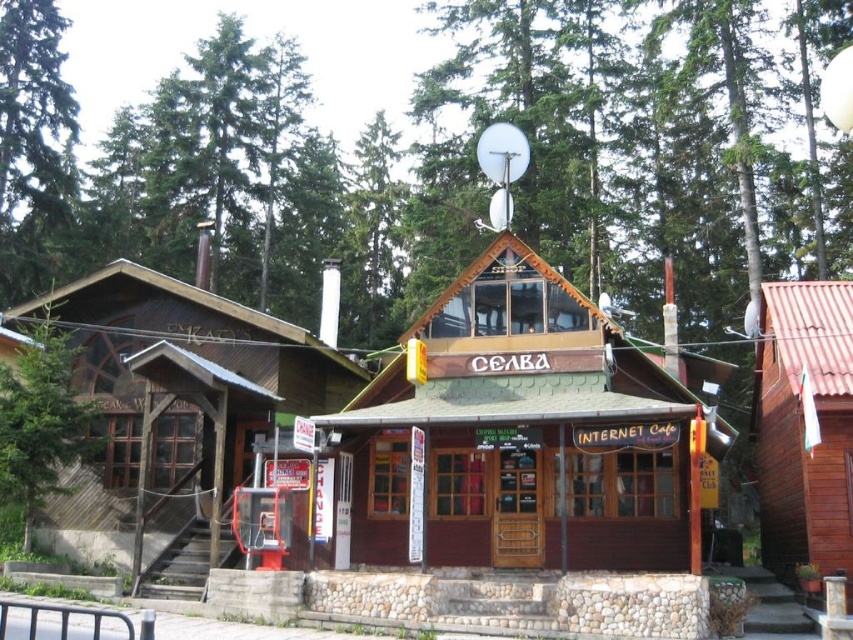
Question: Which of the following is the closest to the observer?

Choices:
 (A) (614, 522)
 (B) (51, 320)

Answer: (A)

Question: Can you confirm if wooden cabin at right is bigger than green textured tree at left?

Choices:
 (A) no
 (B) yes

Answer: (A)

Question: Which object is closer to the camera taking this photo?

Choices:
 (A) wooden cabin at center
 (B) green textured tree at left
 (C) brown wooden cabin at center
 (D) wooden cabin at right

Answer: (C)

Question: Among these points, which one is nearest to the camera?

Choices:
 (A) (105, 376)
 (B) (527, 285)

Answer: (B)

Question: Does wooden cabin at right appear on the left side of green textured tree at left?

Choices:
 (A) no
 (B) yes

Answer: (A)

Question: Is wooden cabin at right positioned before green textured tree at left?

Choices:
 (A) no
 (B) yes

Answer: (B)